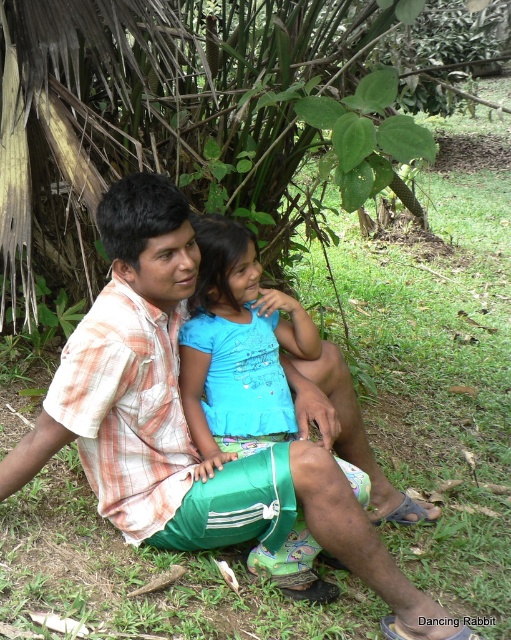
Describe the element at coordinates (181, 113) in the screenshot. I see `green leafy tree at upper center` at that location.

Does point (166, 83) lie behind point (42, 426)?

Yes.

Identify the location of green leafy tree at upper center. The width and height of the screenshot is (511, 640). 181,113.

Based on the photo, which is more to the left, plaid cotton shirt at center or blue fabric shirt at center?

Positioned to the left is plaid cotton shirt at center.

Which is behind, point (174, 516) or point (242, 404)?

The point (242, 404) is behind.

Where is `plaid cotton shirt at center`? This screenshot has width=511, height=640. plaid cotton shirt at center is located at coordinates (188, 429).

Is green leafy tree at upper center thinner than blue fabric shirt at center?

Incorrect, green leafy tree at upper center's width is not less than blue fabric shirt at center's.

Is point (15, 134) farther from camera compared to point (187, 328)?

Yes.

I want to click on green leafy tree at upper center, so click(x=181, y=113).